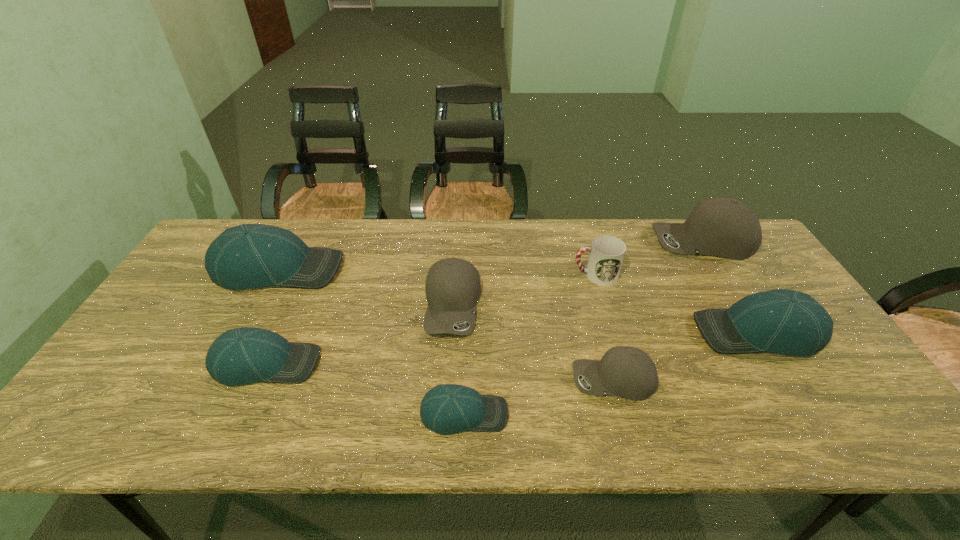
Find the location of a particular element. light baseball cap that is the nearest to the red cup is located at coordinates (783, 321).

Image resolution: width=960 pixels, height=540 pixels. What are the coordinates of `free space in the image that satisfies the following two spatial constraints: 1. on the handle side of the red cup; 2. on the front side of the biggest light baseball cap` in the screenshot? It's located at (593, 269).

The height and width of the screenshot is (540, 960). In order to click on vacant area in the image that satisfies the following two spatial constraints: 1. on the front brim of the third smallest light baseball cap; 2. on the right side of the second biggest gray baseball cap in this screenshot , I will do `click(451, 332)`.